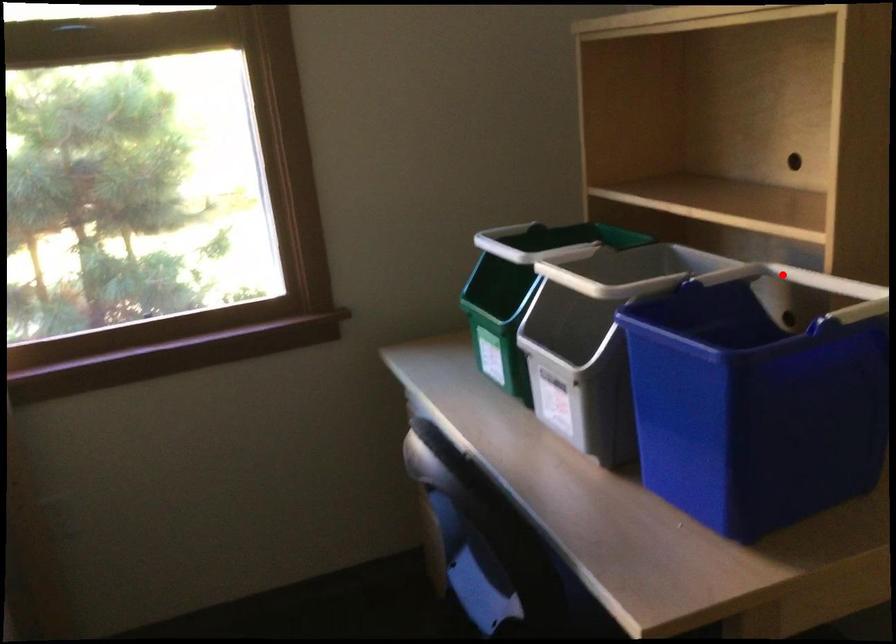
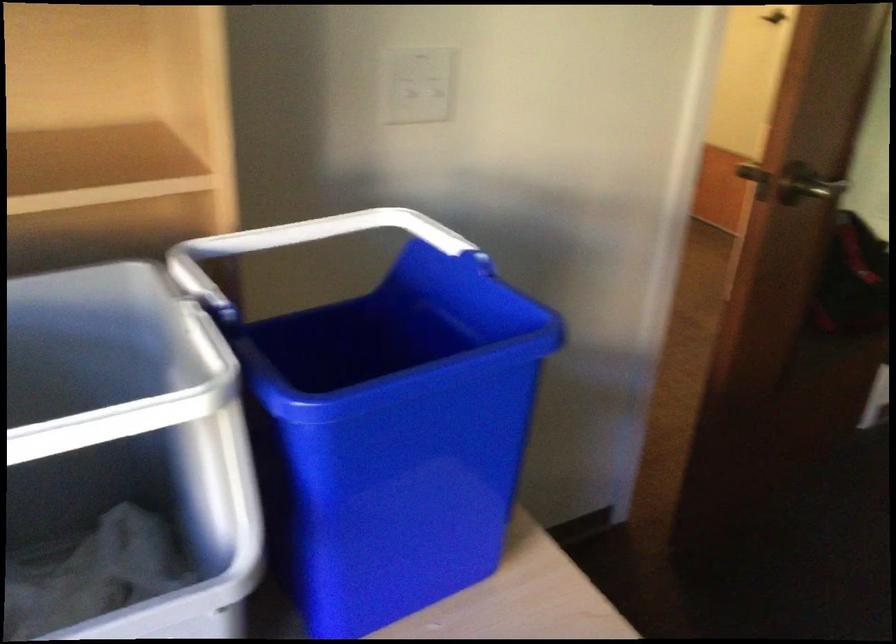
Locate, in the second image, the point that corresponds to the highlighted location in the first image.

(213, 257)